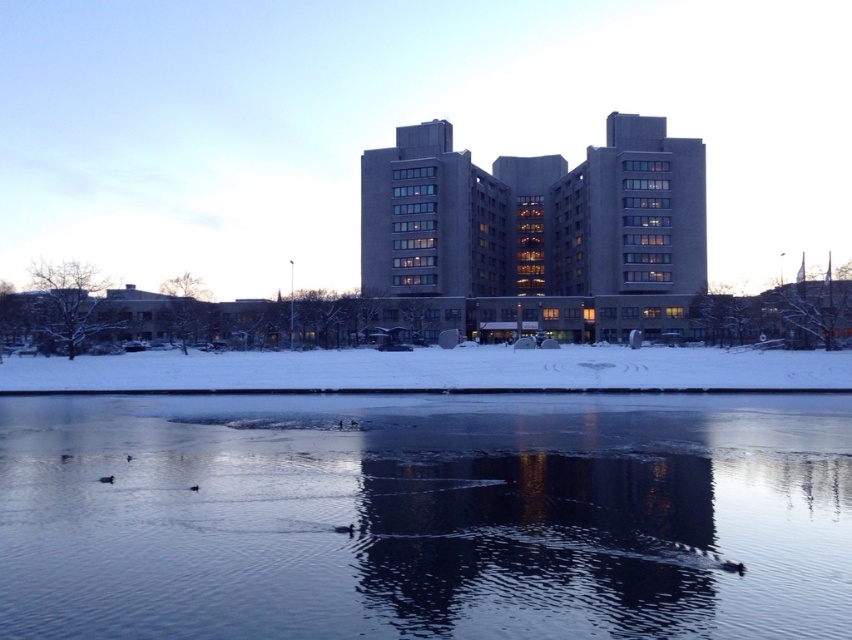
You are standing on the dock and want to walk to the transparent ice at center. Which direction should you move to reach it?

The transparent ice at center is located at point (426,516), so you should move towards the center of the water to reach it.

Looking at this image, you are an architect reviewing the winter scene and need to determine the spatial relationship between the transparent ice at center and the gray concrete building at center. Based on the scene, which object is positioned lower in the image?

The transparent ice at center is located below the gray concrete building at center, so it is positioned lower in the image.